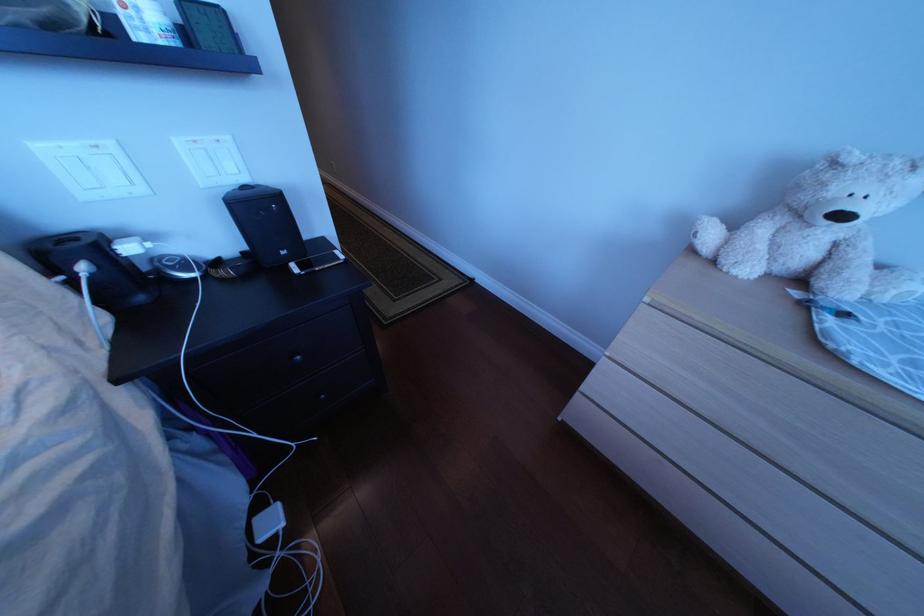
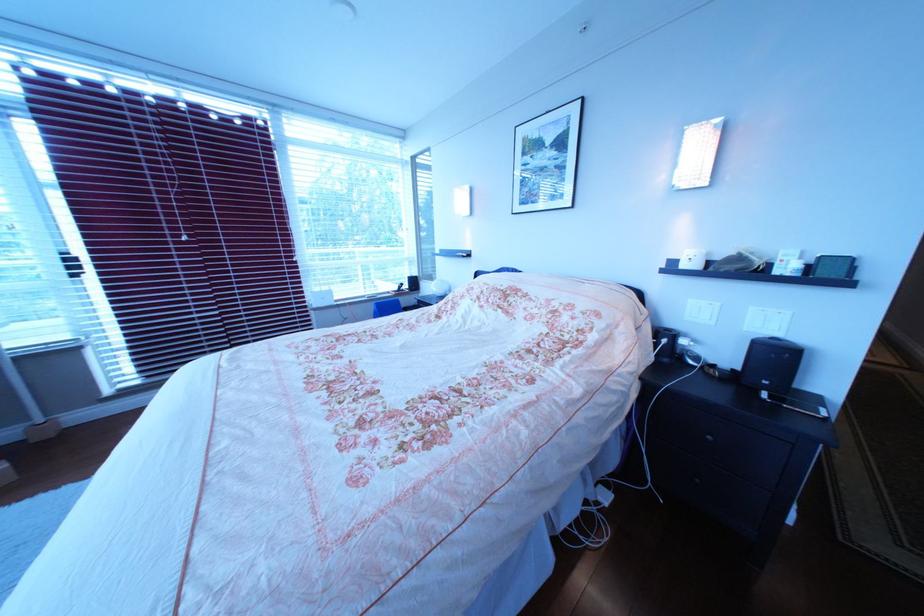
The point at (298, 254) is marked in the first image. Where is the corresponding point in the second image?

(782, 384)